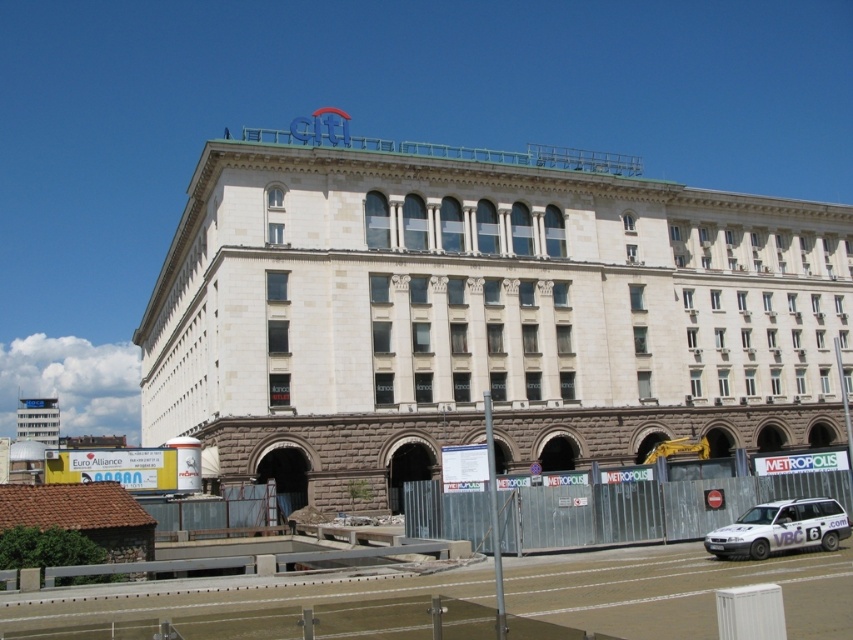
Question: From the image, what is the correct spatial relationship of white stone building at upper center in relation to white matte van at lower right?

Choices:
 (A) below
 (B) above

Answer: (B)

Question: Which of the following is the farthest from the observer?

Choices:
 (A) white stone building at upper center
 (B) white matte van at lower right

Answer: (A)

Question: Considering the relative positions of white stone building at upper center and white matte van at lower right in the image provided, where is white stone building at upper center located with respect to white matte van at lower right?

Choices:
 (A) right
 (B) left

Answer: (B)

Question: Which object is farther from the camera taking this photo?

Choices:
 (A) white stone building at upper center
 (B) white matte van at lower right

Answer: (A)

Question: Considering the relative positions of white stone building at upper center and white matte van at lower right in the image provided, where is white stone building at upper center located with respect to white matte van at lower right?

Choices:
 (A) left
 (B) right

Answer: (A)

Question: Among these points, which one is farthest from the camera?

Choices:
 (A) (164, 308)
 (B) (706, 540)

Answer: (A)